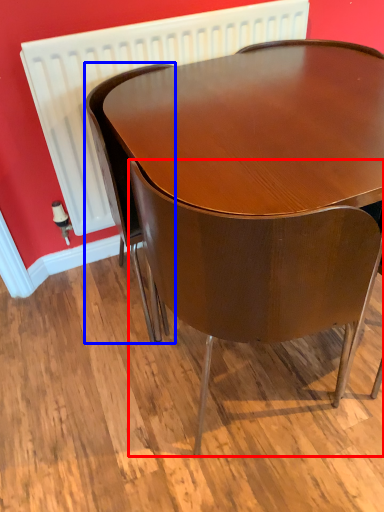
Question: Which of the following is the farthest to the observer, chair (highlighted by a red box) or chair (highlighted by a blue box)?

Choices:
 (A) chair
 (B) chair

Answer: (B)